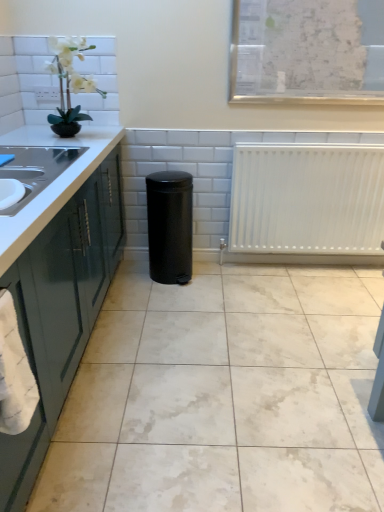
Question: Could you tell me if white matte radiator at center is turned towards white paper map at upper right?

Choices:
 (A) yes
 (B) no

Answer: (B)

Question: Is white matte radiator at center not inside white paper map at upper right?

Choices:
 (A) no
 (B) yes

Answer: (B)

Question: From the image's perspective, is white matte radiator at center on top of white paper map at upper right?

Choices:
 (A) no
 (B) yes

Answer: (A)

Question: From a real-world perspective, is white matte radiator at center under white paper map at upper right?

Choices:
 (A) no
 (B) yes

Answer: (B)

Question: Is white matte radiator at center thinner than white paper map at upper right?

Choices:
 (A) yes
 (B) no

Answer: (B)

Question: Is white matte radiator at center shorter than white paper map at upper right?

Choices:
 (A) yes
 (B) no

Answer: (B)

Question: Is white matte orchid at upper left smaller than white glossy countertop at left, arranged as the first countertop when viewed from the top?

Choices:
 (A) yes
 (B) no

Answer: (A)

Question: Does white matte orchid at upper left turn towards white glossy countertop at left, which appears as the second countertop when ordered from the bottom?

Choices:
 (A) yes
 (B) no

Answer: (B)

Question: Does white matte orchid at upper left have a lesser width compared to white glossy countertop at left, which appears as the second countertop when ordered from the bottom?

Choices:
 (A) no
 (B) yes

Answer: (B)

Question: Considering the relative sizes of white matte orchid at upper left and white glossy countertop at left, arranged as the first countertop when viewed from the top, in the image provided, is white matte orchid at upper left bigger than white glossy countertop at left, arranged as the first countertop when viewed from the top,?

Choices:
 (A) yes
 (B) no

Answer: (B)

Question: From a real-world perspective, is white matte orchid at upper left positioned over white glossy countertop at left, arranged as the first countertop when viewed from the top, based on gravity?

Choices:
 (A) no
 (B) yes

Answer: (B)

Question: From the image's perspective, would you say white matte orchid at upper left is shown under white glossy countertop at left, which appears as the second countertop when ordered from the bottom?

Choices:
 (A) yes
 (B) no

Answer: (B)

Question: Does white glossy countertop at left, which ranks as the first countertop in bottom-to-top order, have a lesser height compared to black matte trash can at center?

Choices:
 (A) no
 (B) yes

Answer: (A)